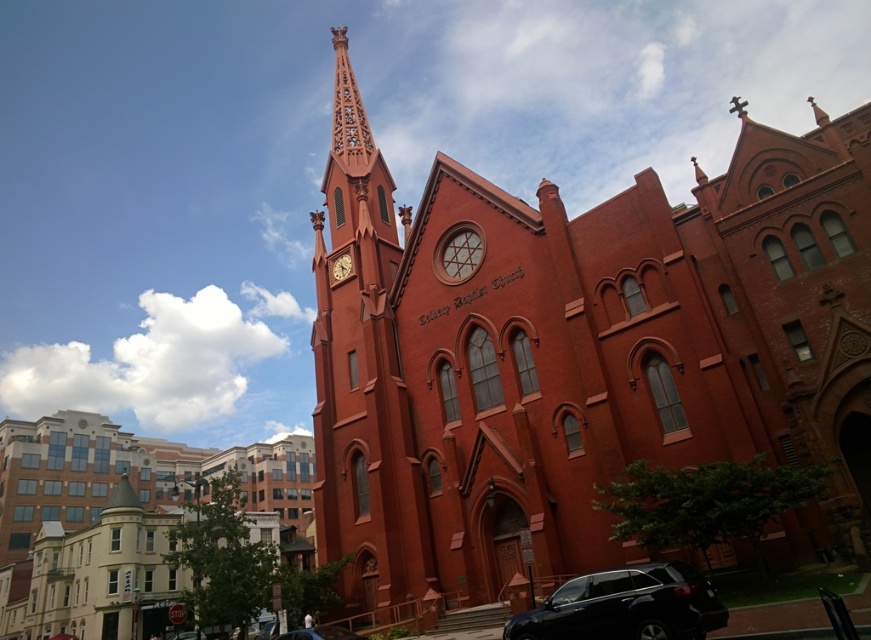
Question: Estimate the real-world distances between objects in this image. Which object is closer to the black matte suv at lower right?

Choices:
 (A) smooth brick tower at center
 (B) shiny black car at lower center
 (C) matte brick church at center

Answer: (B)

Question: Can you confirm if matte brick church at center is positioned above matte brown clock at upper center?

Choices:
 (A) no
 (B) yes

Answer: (B)

Question: Does matte brick church at center have a smaller size compared to matte brown clock at upper center?

Choices:
 (A) no
 (B) yes

Answer: (A)

Question: Which point appears closest to the camera in this image?

Choices:
 (A) (352, 230)
 (B) (684, 566)
 (C) (319, 636)

Answer: (B)

Question: Considering the relative positions of matte brick church at center and black matte suv at lower right in the image provided, where is matte brick church at center located with respect to black matte suv at lower right?

Choices:
 (A) below
 (B) above

Answer: (B)

Question: Which object is positioned closest to the smooth brick tower at center?

Choices:
 (A) matte brown clock at upper center
 (B) matte brick church at center

Answer: (B)